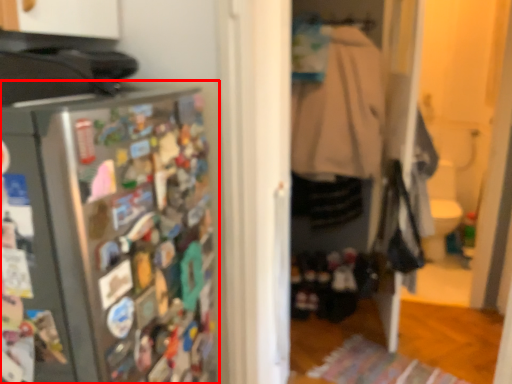
Question: From the image's perspective, considering the relative positions of refrigerator (annotated by the red box) and clothing in the image provided, where is refrigerator (annotated by the red box) located with respect to the staircase?

Choices:
 (A) below
 (B) above

Answer: (A)